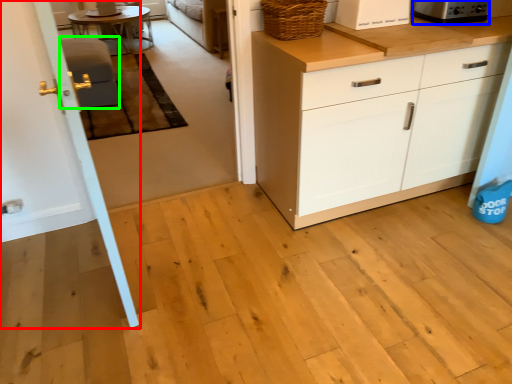
Question: Based on their relative distances, which object is farther from door (highlighted by a red box)? Choose from appliance (highlighted by a blue box) and armchair (highlighted by a green box).

Choices:
 (A) appliance
 (B) armchair

Answer: (A)